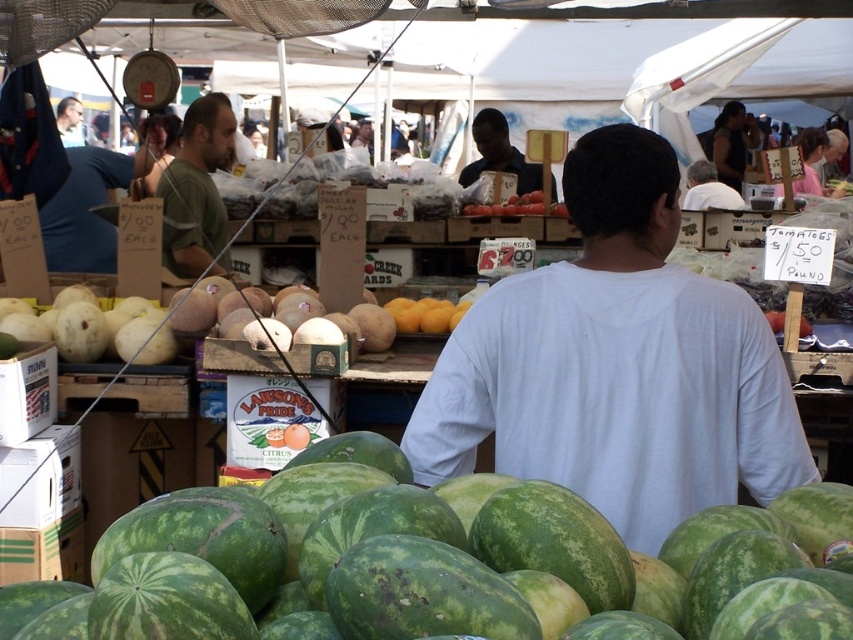
Is green cotton shirt at center below smooth black shirt at center?

Yes.

Who is lower down, green cotton shirt at center or smooth black shirt at center?

green cotton shirt at center is below.

Where is `green cotton shirt at center`? green cotton shirt at center is located at coordinates (196, 188).

Is green striped water at center to the left of yellow matte peaches at center from the viewer's perspective?

No, green striped water at center is not to the left of yellow matte peaches at center.

Which of these two, green striped water at center or yellow matte peaches at center, stands taller?

green striped water at center is taller.

The width and height of the screenshot is (853, 640). Describe the element at coordinates (415, 563) in the screenshot. I see `green striped water at center` at that location.

The width and height of the screenshot is (853, 640). What are the coordinates of `green striped water at center` in the screenshot? It's located at (415, 563).

Which is in front, point (401, 332) or point (704, 161)?

Point (401, 332)

Does yellow matte peaches at center have a greater width compared to white cotton shirt at upper center?

In fact, yellow matte peaches at center might be narrower than white cotton shirt at upper center.

Which is behind, point (396, 316) or point (730, 193)?

The point (730, 193) is behind.

The image size is (853, 640). I want to click on yellow matte peaches at center, so click(x=425, y=314).